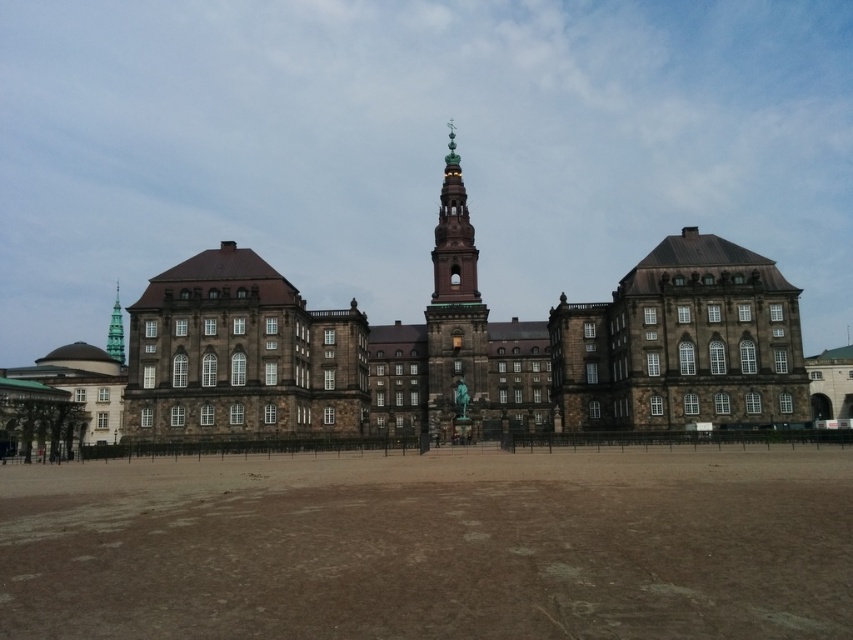
Which is behind, point (602, 557) or point (444, 410)?

The point (444, 410) is more distant.

Is the position of brown sandy ground at center more distant than that of green copper bell tower at center?

No, it is in front of green copper bell tower at center.

Is point (589, 480) closer to camera compared to point (440, 332)?

Yes.

Where is `brown sandy ground at center`? This screenshot has height=640, width=853. brown sandy ground at center is located at coordinates (432, 547).

Which is behind, point (297, 600) or point (117, 292)?

Point (117, 292)

Can you confirm if brown sandy ground at center is bigger than green glass bell tower at upper center?

Yes.

Who is more forward, (231, 582) or (109, 342)?

Point (231, 582)

The width and height of the screenshot is (853, 640). In order to click on brown sandy ground at center in this screenshot , I will do `click(432, 547)`.

Which is more to the right, brown sandy ground at center or brown stone building at center?

brown sandy ground at center is more to the right.

Identify the location of brown sandy ground at center. (432, 547).

What do you see at coordinates (432, 547) in the screenshot? I see `brown sandy ground at center` at bounding box center [432, 547].

Find the location of a particular element. The height and width of the screenshot is (640, 853). brown sandy ground at center is located at coordinates (432, 547).